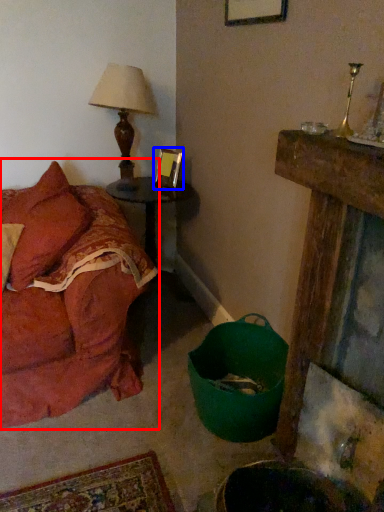
Question: Which object appears farthest to the camera in this image, studio couch (highlighted by a red box) or picture frame (highlighted by a blue box)?

Choices:
 (A) studio couch
 (B) picture frame

Answer: (B)